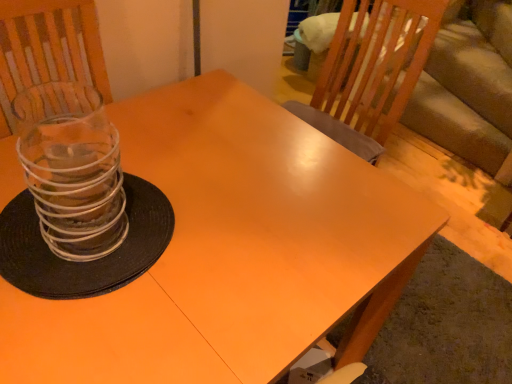
You are a GUI agent. You are given a task and a screenshot of the screen. Output one action in this format:
    pyautogui.click(x=<x>, y=<y>)
    Task: Click on the free space to the right of clear glass candle holder at left
    
    Given the screenshot: What is the action you would take?
    pyautogui.click(x=191, y=271)